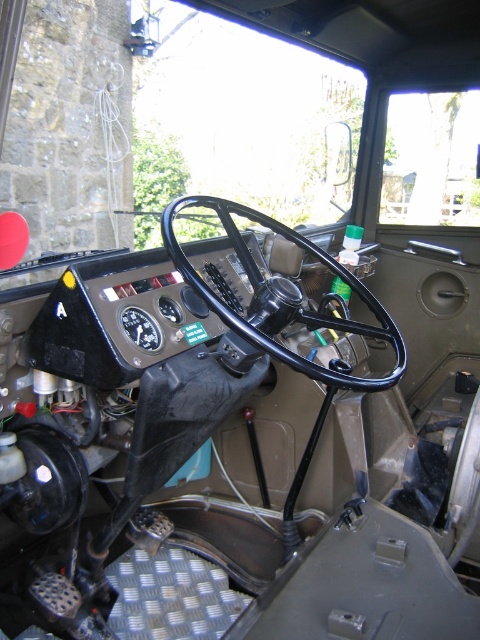
Question: Which of the following is the closest to the observer?

Choices:
 (A) black rubber steering wheel at center
 (B) transparent glass windshield at upper center

Answer: (A)

Question: Is transparent glass windshield at upper center bigger than black rubber steering wheel at center?

Choices:
 (A) yes
 (B) no

Answer: (A)

Question: Is transparent glass windshield at upper center smaller than black rubber steering wheel at center?

Choices:
 (A) no
 (B) yes

Answer: (A)

Question: Is transparent glass windshield at upper center smaller than black rubber steering wheel at center?

Choices:
 (A) yes
 (B) no

Answer: (B)

Question: Which point is farther from the camera taking this photo?

Choices:
 (A) pos(394,346)
 (B) pos(187,42)

Answer: (B)